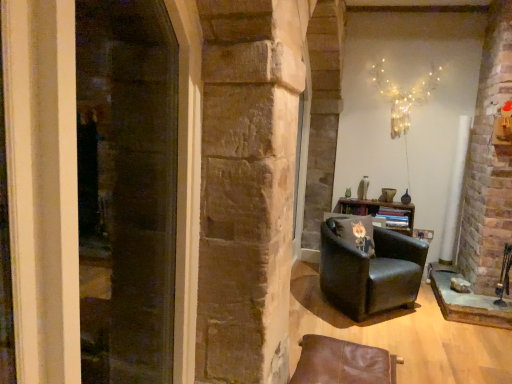
Question: Is black fabric pillow at center-right inside the boundaries of black leather armchair at center-right, which is the 1th chair from back to front, or outside?

Choices:
 (A) outside
 (B) inside

Answer: (B)

Question: Would you say black fabric pillow at center-right is to the left or to the right of black leather armchair at center-right, which ranks as the 2th chair in front-to-back order, in the picture?

Choices:
 (A) left
 (B) right

Answer: (A)

Question: Which object is the farthest from the transparent glass screen door at left?

Choices:
 (A) black fabric pillow at center-right
 (B) black leather armchair at center-right, which ranks as the 2th chair in front-to-back order
 (C) brown leather chair at lower right, which is counted as the 1th chair, starting from the front
 (D) illuminated wire at upper center

Answer: (D)

Question: Estimate the real-world distances between objects in this image. Which object is farther from the black fabric pillow at center-right?

Choices:
 (A) illuminated wire at upper center
 (B) black leather armchair at center-right, which is the 1th chair from back to front
 (C) transparent glass screen door at left
 (D) brown leather chair at lower right, which is the 2th chair from back to front

Answer: (C)